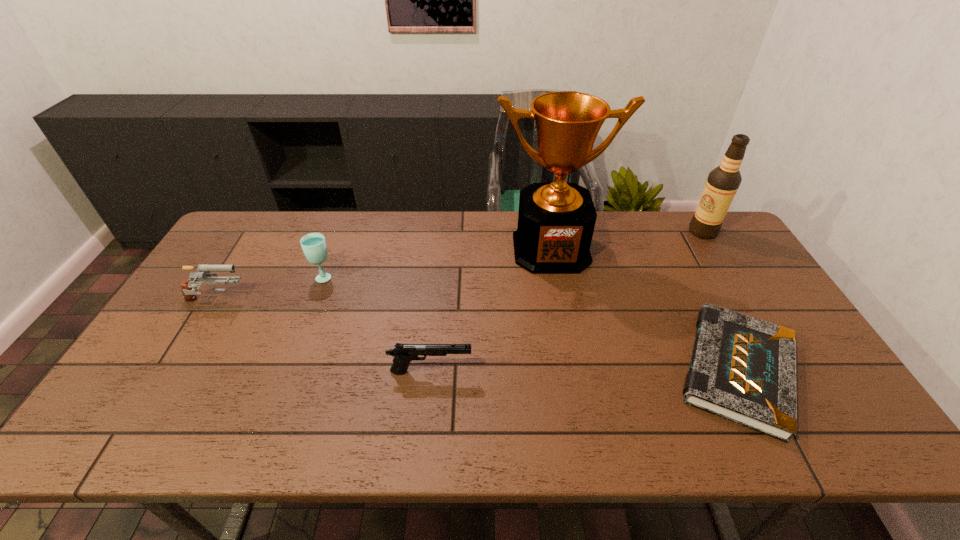
The width and height of the screenshot is (960, 540). Find the location of `object that is at the left edge`. object that is at the left edge is located at coordinates (189, 291).

This screenshot has width=960, height=540. I want to click on alcohol that is positioned at the right edge, so click(723, 182).

Locate an element on the screen. Image resolution: width=960 pixels, height=540 pixels. notebook located at the right edge is located at coordinates (743, 369).

Identify the location of object located at the far right corner. The height and width of the screenshot is (540, 960). (723, 182).

Find the location of `object positioned at the near right corner`. object positioned at the near right corner is located at coordinates (743, 369).

Locate an element on the screen. The height and width of the screenshot is (540, 960). free location at the far edge is located at coordinates (512, 244).

Locate an element on the screen. The image size is (960, 540). free space at the near edge is located at coordinates (583, 435).

This screenshot has width=960, height=540. In the image, there is a desktop. In order to click on free space at the left edge in this screenshot , I will do `click(187, 389)`.

Locate an element on the screen. This screenshot has width=960, height=540. free space at the right edge of the desktop is located at coordinates (738, 286).

Image resolution: width=960 pixels, height=540 pixels. I want to click on free space at the far left corner of the desktop, so click(x=260, y=228).